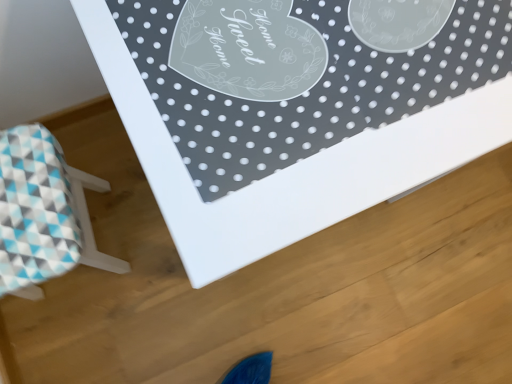
This screenshot has height=384, width=512. In order to click on blank space situated above blue checkered stool at lower left (from a real-world perspective) in this screenshot , I will do `click(24, 207)`.